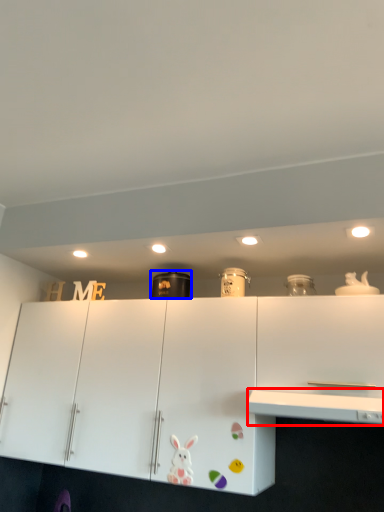
Question: Which object is further to the camera taking this photo, counter top (highlighted by a red box) or appliance (highlighted by a blue box)?

Choices:
 (A) counter top
 (B) appliance

Answer: (B)